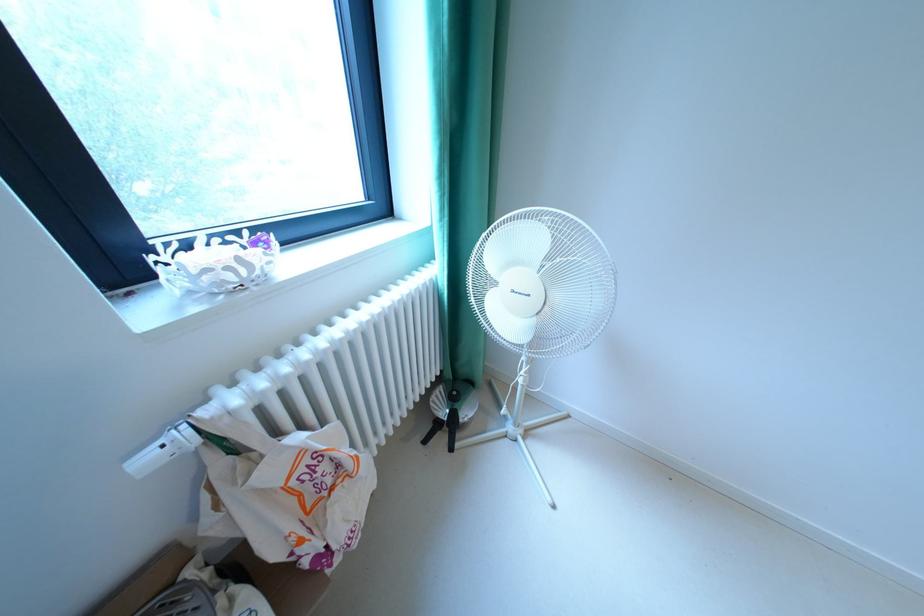
Describe the element at coordinates (448, 427) in the screenshot. I see `a fan control hub` at that location.